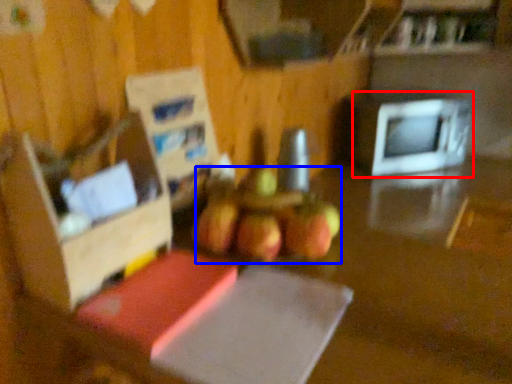
Question: Which object appears closest to the camera in this image, microwave oven (highlighted by a red box) or apple (highlighted by a blue box)?

Choices:
 (A) microwave oven
 (B) apple

Answer: (B)